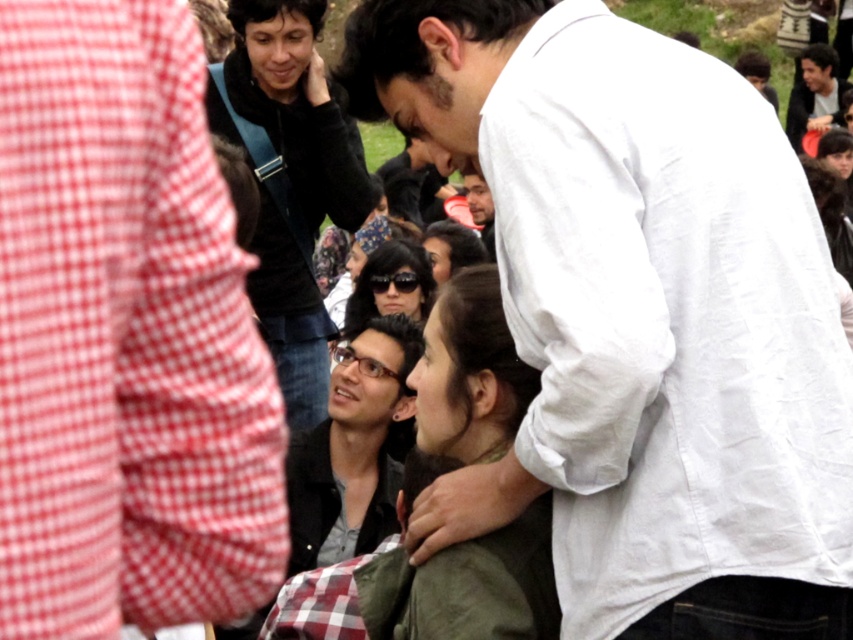
Question: Does white cotton shirt at upper right lie behind matte black glasses at center?

Choices:
 (A) no
 (B) yes

Answer: (A)

Question: Is white cotton shirt at upper right bigger than matte black glasses at center?

Choices:
 (A) yes
 (B) no

Answer: (A)

Question: Which point appears closest to the camera in this image?

Choices:
 (A) (368, 412)
 (B) (575, 637)

Answer: (B)

Question: Which point is closer to the camera?

Choices:
 (A) matte black glasses at center
 (B) white cotton shirt at upper right

Answer: (B)

Question: Does white cotton shirt at upper right appear over matte black glasses at center?

Choices:
 (A) yes
 (B) no

Answer: (A)